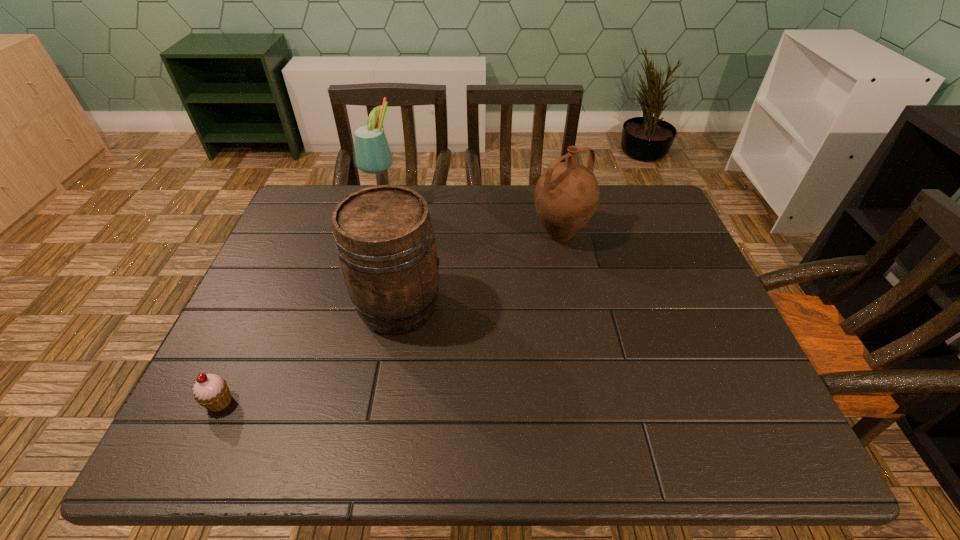
The height and width of the screenshot is (540, 960). What are the coordinates of `vacant region that satisfies the following two spatial constraints: 1. on the front side of the alcohol; 2. on the right side of the pitcher` in the screenshot? It's located at (378, 234).

Locate an element on the screen. This screenshot has width=960, height=540. vacant space that satisfies the following two spatial constraints: 1. on the back side of the rightmost object; 2. on the left side of the shortest object is located at coordinates (296, 234).

You are a GUI agent. You are given a task and a screenshot of the screen. Output one action in this format:
    pyautogui.click(x=<x>, y=<y>)
    Task: Click on the free region that satisfies the following two spatial constraints: 1. on the side of the cider near the bung hole; 2. on the front side of the cupcake
    
    Given the screenshot: What is the action you would take?
    pyautogui.click(x=383, y=401)